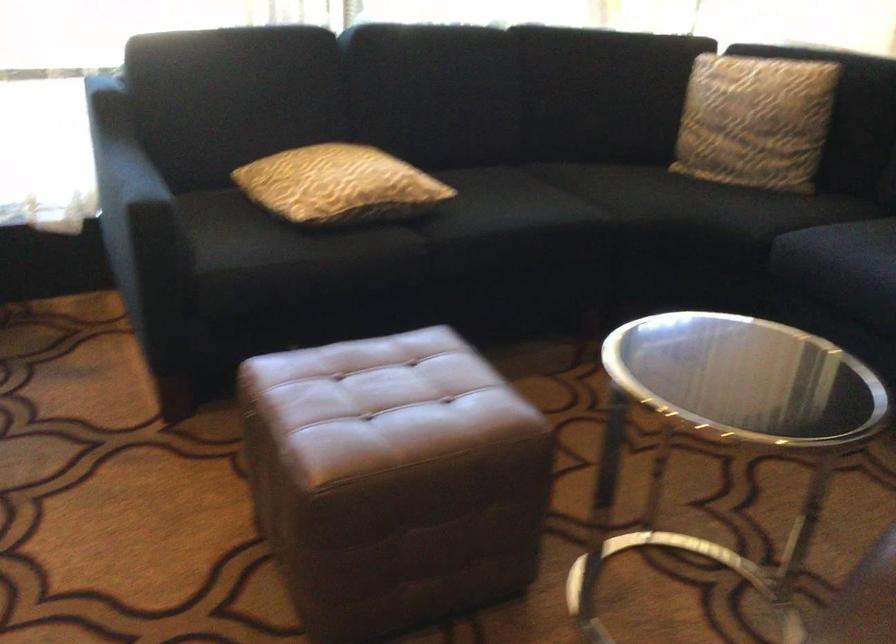
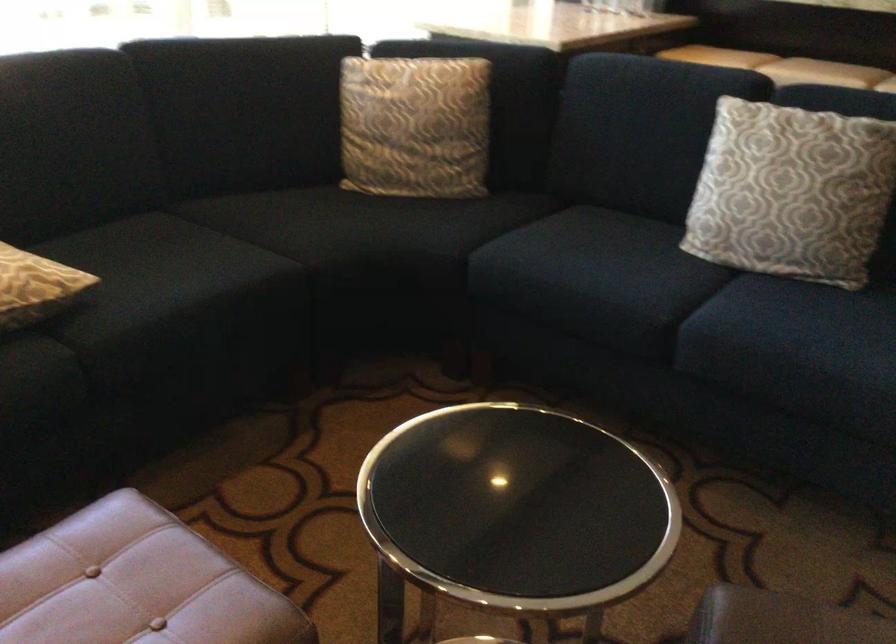
Question: Based on the continuous images, in which direction is the camera rotating? Reply with the corresponding letter.

Choices:
 (A) Left
 (B) Right
 (C) Up
 (D) Down

Answer: (B)